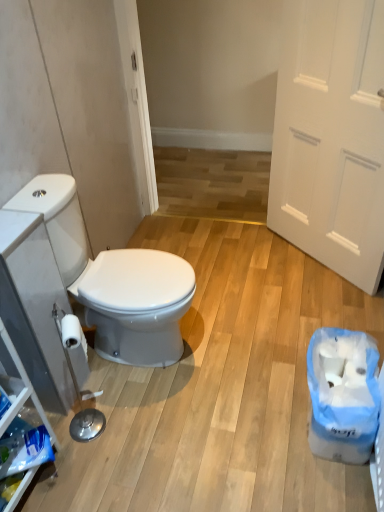
Identify the location of free space between white glossy toilet seat at left and blue plastic bag at lower right. (234, 388).